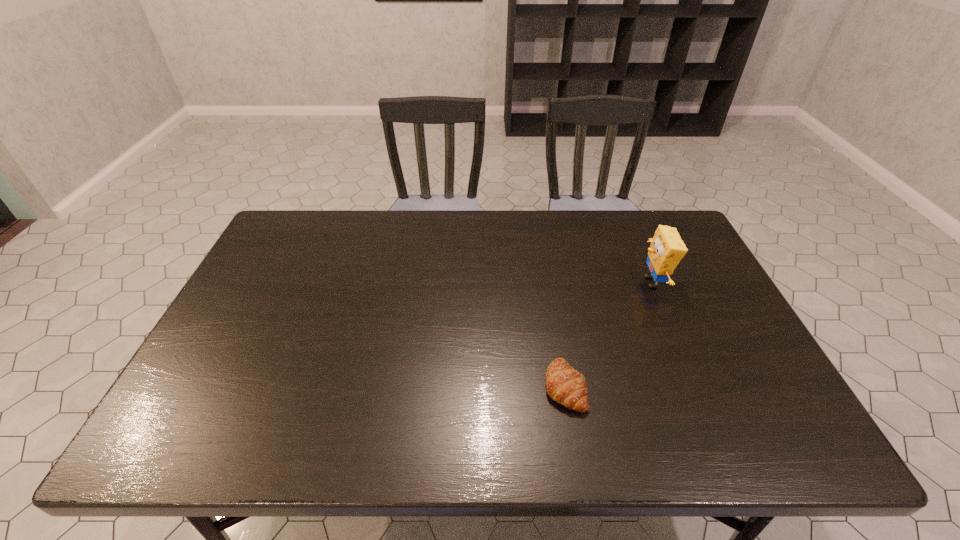
The height and width of the screenshot is (540, 960). I want to click on free space at the near edge of the desktop, so click(713, 437).

The width and height of the screenshot is (960, 540). What are the coordinates of `vacant area at the left edge of the desktop` in the screenshot? It's located at (262, 257).

You are a GUI agent. You are given a task and a screenshot of the screen. Output one action in this format:
    pyautogui.click(x=<x>, y=<y>)
    Task: Click on the blank area at the right edge
    
    Given the screenshot: What is the action you would take?
    pyautogui.click(x=684, y=263)

In the image, there is a desktop. At what (x,y) coordinates should I click in order to perform the action: click on free region at the far right corner. Please return your answer as a coordinate pair (x, y). The image size is (960, 540). Looking at the image, I should click on (693, 252).

In the image, there is a desktop. At what (x,y) coordinates should I click in order to perform the action: click on free space at the near right corner. Please return your answer as a coordinate pair (x, y). Image resolution: width=960 pixels, height=540 pixels. Looking at the image, I should click on (801, 428).

Find the location of a particular element. This screenshot has width=960, height=540. free space in the image that satisfies the following two spatial constraints: 1. on the face of the farther object; 2. on the front side of the shorter object is located at coordinates (696, 387).

Image resolution: width=960 pixels, height=540 pixels. In order to click on free space in the image that satisfies the following two spatial constraints: 1. on the face of the sponge; 2. on the front side of the left object in this screenshot , I will do `click(696, 387)`.